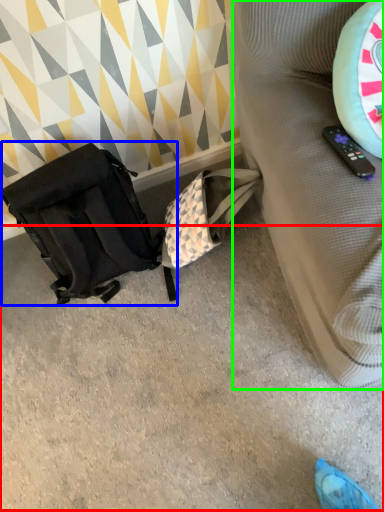
Question: Estimate the real-world distances between objects in this image. Which object is farther from concrete (highlighted by a red box), luggage and bags (highlighted by a blue box) or furniture (highlighted by a green box)?

Choices:
 (A) luggage and bags
 (B) furniture

Answer: (B)